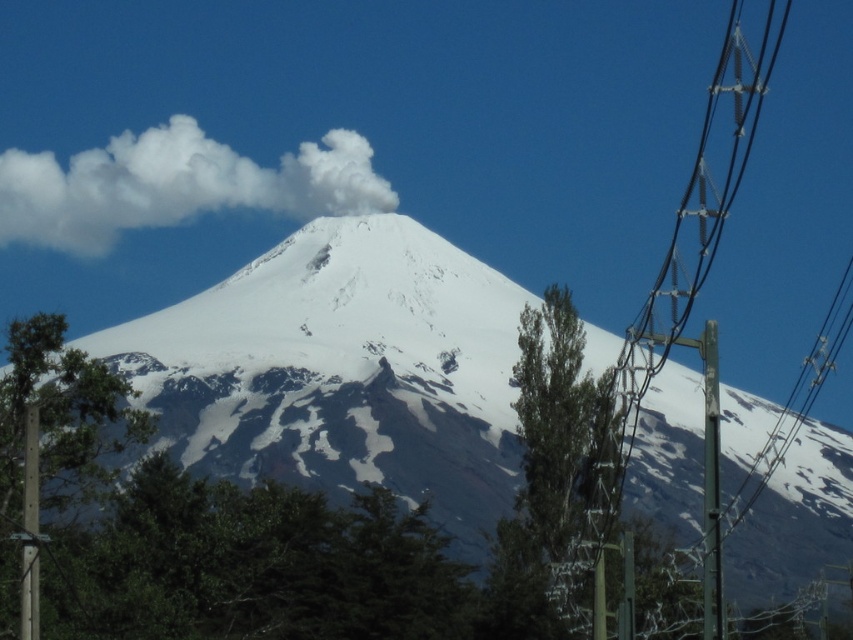
Does point (833, 448) come behind point (622, 424)?

Yes.

Who is shorter, white snow-covered mountain at center or metallic silver power line at right?

white snow-covered mountain at center

Find the location of `white snow-covered mountain at center`. white snow-covered mountain at center is located at coordinates (341, 371).

At what (x,y) coordinates should I click in order to perform the action: click on white snow-covered mountain at center. Please return your answer as a coordinate pair (x, y). The height and width of the screenshot is (640, 853). Looking at the image, I should click on (341, 371).

Is metallic silver power line at right behind green metallic pole at right?

Yes, it is behind green metallic pole at right.

Is metallic silver power line at right below green metallic pole at right?

Actually, metallic silver power line at right is above green metallic pole at right.

Between point (747, 76) and point (709, 637), which one is positioned behind?

The point (747, 76) is more distant.

I want to click on metallic silver power line at right, so click(688, 305).

Which is above, green metallic pole at right or wooden post at left?

green metallic pole at right is higher up.

Is point (706, 452) farther from viewer compared to point (27, 573)?

Yes, point (706, 452) is behind point (27, 573).

Identify the location of green metallic pole at right. (711, 484).